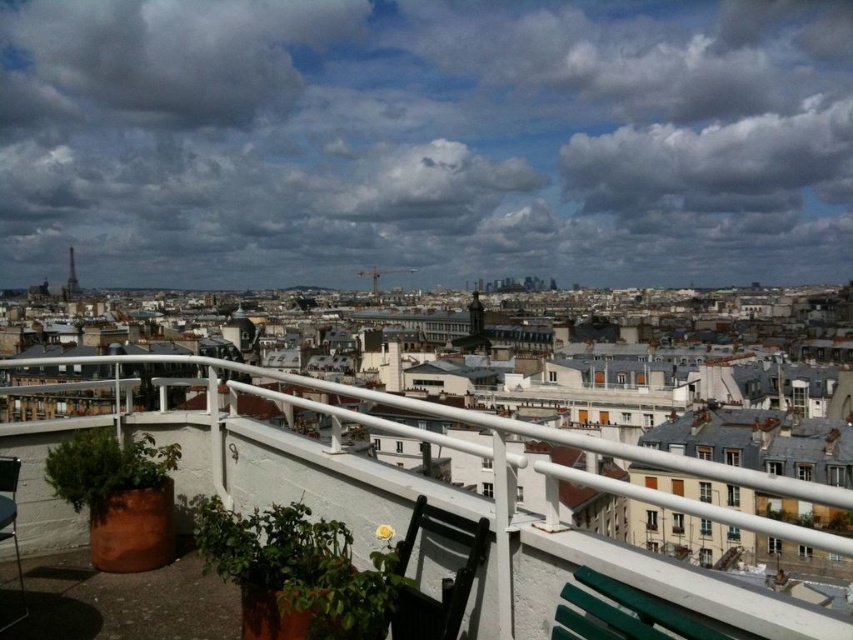
Question: Does black plastic chair at lower center have a larger size compared to metallic silver chair at lower left?

Choices:
 (A) yes
 (B) no

Answer: (B)

Question: Which of the following is the closest to the observer?

Choices:
 (A) white metal railing at upper center
 (B) green plastic chair at lower right

Answer: (A)

Question: Does white metal railing at upper center come behind green plastic chair at lower right?

Choices:
 (A) yes
 (B) no

Answer: (B)

Question: Which point is farther to the camera?

Choices:
 (A) metallic silver chair at lower left
 (B) black plastic chair at lower center
 (C) white metal railing at upper center

Answer: (B)

Question: Is black plastic chair at lower center below green plastic chair at lower right?

Choices:
 (A) yes
 (B) no

Answer: (B)

Question: Which is nearer to the white metal railing at upper center?

Choices:
 (A) metallic silver chair at lower left
 (B) black plastic chair at lower center
 (C) green plastic chair at lower right

Answer: (B)